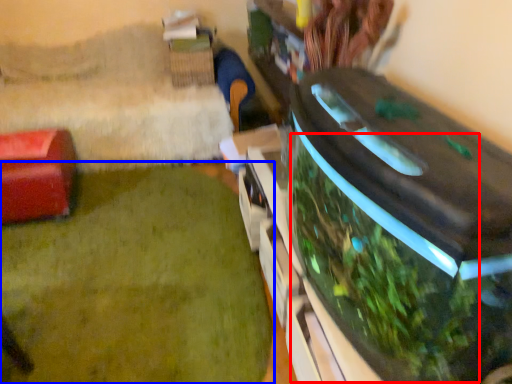
Question: Among these objects, which one is farthest to the camera, vegetation (highlighted by a red box) or plant (highlighted by a blue box)?

Choices:
 (A) vegetation
 (B) plant

Answer: (B)